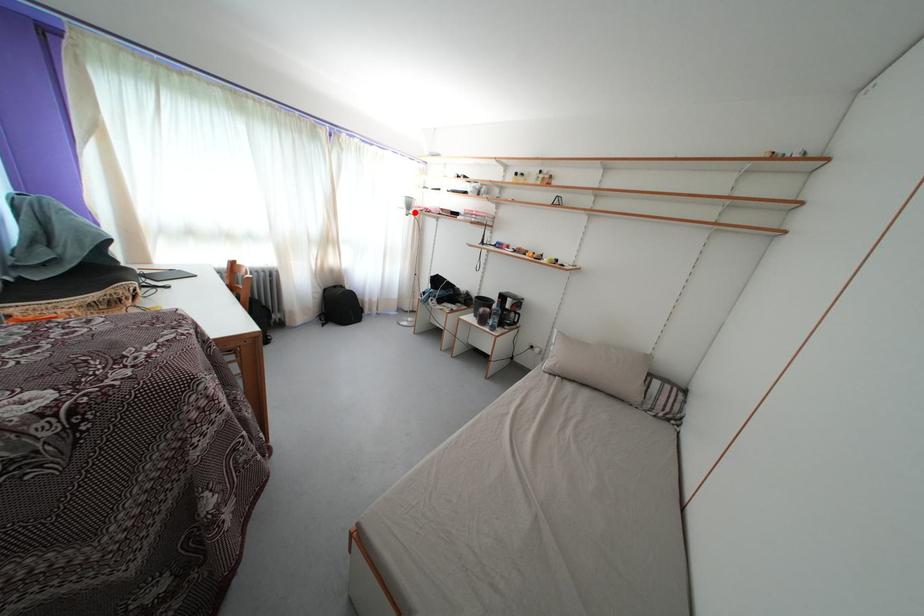
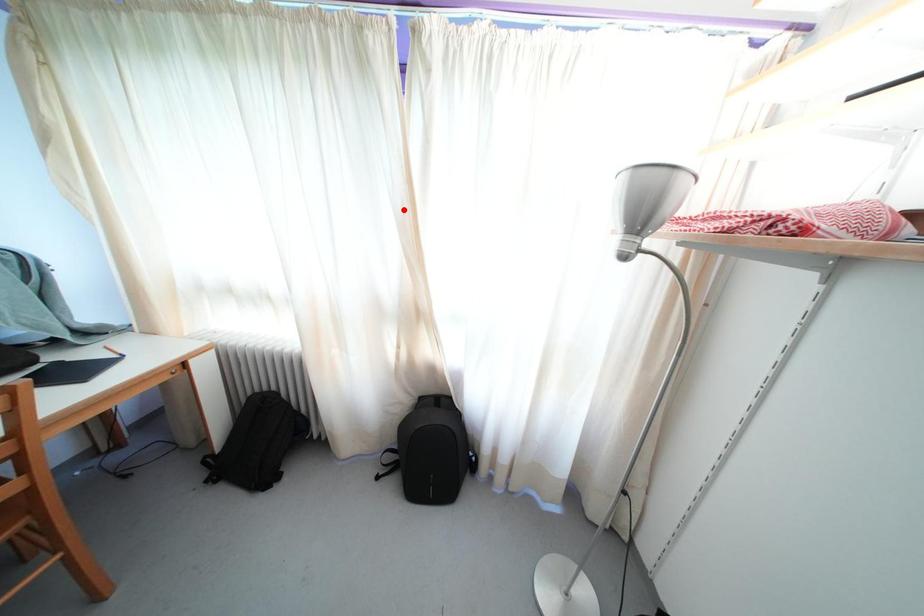
I am providing you with two images of the same scene from different viewpoints. A red point is marked on the first image and another point is marked on the second image. Does the point marked in image1 correspond to the same location as the one in image2?

No